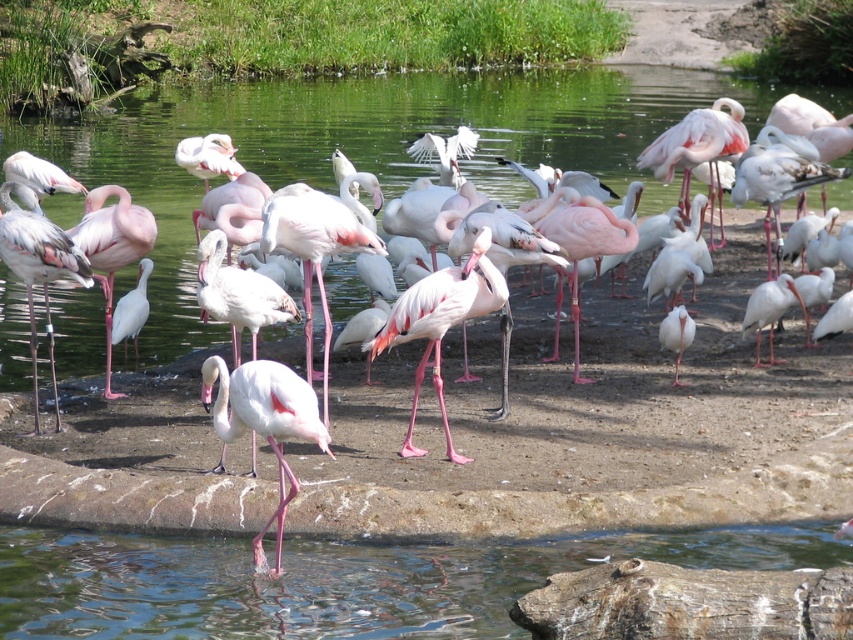
You are a birdwatcher observing the scene. You see the clear water at lower center and the white glossy ibis at right. Which object is positioned more to the right side of the image?

The white glossy ibis at right is positioned more to the right side of the image than the clear water at lower center.

You are standing in the middle of the pond and see two points in the scene. Which point is closer to you, point (219, 150) or point (691, 321)?

Point (219, 150) is closer to you because it is further to the viewer than point (691, 321).